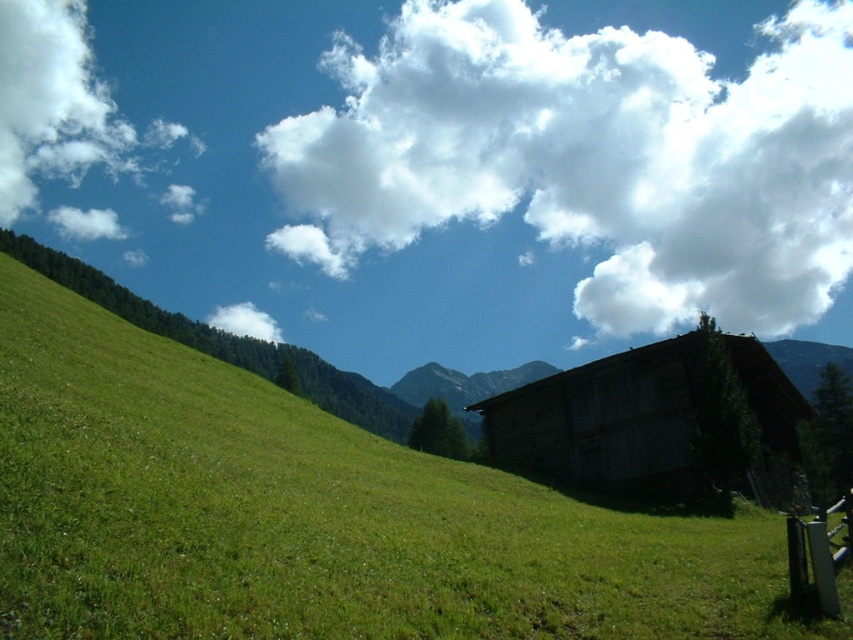
This screenshot has height=640, width=853. Describe the element at coordinates (312, 515) in the screenshot. I see `green grassy at lower left` at that location.

Does green grassy at lower left lie in front of weathered wood barn at lower right?

That is True.

The image size is (853, 640). What do you see at coordinates (312, 515) in the screenshot?
I see `green grassy at lower left` at bounding box center [312, 515].

Where is `green grassy at lower left`? This screenshot has height=640, width=853. green grassy at lower left is located at coordinates (312, 515).

Who is more forward, (253, 636) or (697, 288)?

Point (253, 636) is in front.

Does green grassy at lower left appear over white fluffy cloud at upper center?

Actually, green grassy at lower left is below white fluffy cloud at upper center.

What are the coordinates of `green grassy at lower left` in the screenshot? It's located at (312, 515).

Is white fluffy cloud at upper center to the right of weathered wood barn at lower right from the viewer's perspective?

Yes, white fluffy cloud at upper center is to the right of weathered wood barn at lower right.

Is white fluffy cloud at upper center wider than weathered wood barn at lower right?

Correct, the width of white fluffy cloud at upper center exceeds that of weathered wood barn at lower right.

Image resolution: width=853 pixels, height=640 pixels. What do you see at coordinates (590, 157) in the screenshot?
I see `white fluffy cloud at upper center` at bounding box center [590, 157].

Find the location of a particular element. white fluffy cloud at upper center is located at coordinates (590, 157).